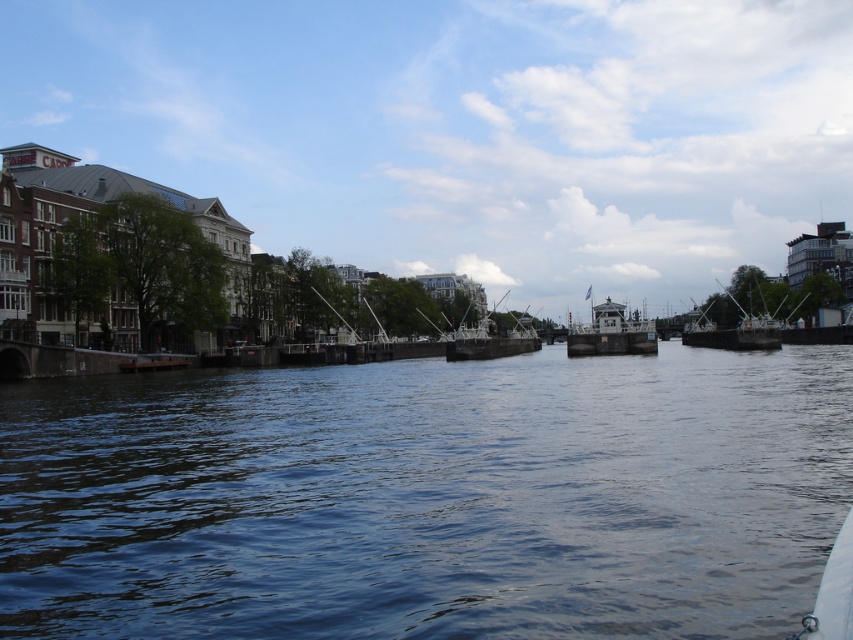
Question: Can you confirm if dark blue water at center is thinner than metallic gray boat at right?

Choices:
 (A) yes
 (B) no

Answer: (B)

Question: Can you confirm if metallic gray cabin at center is wider than metallic silver boat at center?

Choices:
 (A) yes
 (B) no

Answer: (A)

Question: Which point appears farthest from the camera in this image?

Choices:
 (A) (746, 342)
 (B) (645, 332)

Answer: (B)

Question: Considering the real-world distances, which object is farthest from the dark blue water at center?

Choices:
 (A) metallic gray cabin at center
 (B) metallic gray boat at right

Answer: (B)

Question: Can you confirm if metallic gray boat at right is wider than metallic silver boat at center?

Choices:
 (A) no
 (B) yes

Answer: (B)

Question: Which point is closer to the camera?

Choices:
 (A) metallic silver boat at center
 (B) dark blue water at center
 (C) metallic gray cabin at center
 (D) metallic gray boat at right

Answer: (B)